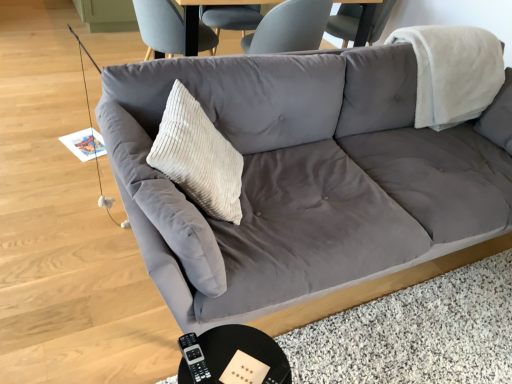
Where is `vacant space behind black plastic remote at lower center`? The width and height of the screenshot is (512, 384). vacant space behind black plastic remote at lower center is located at coordinates (216, 340).